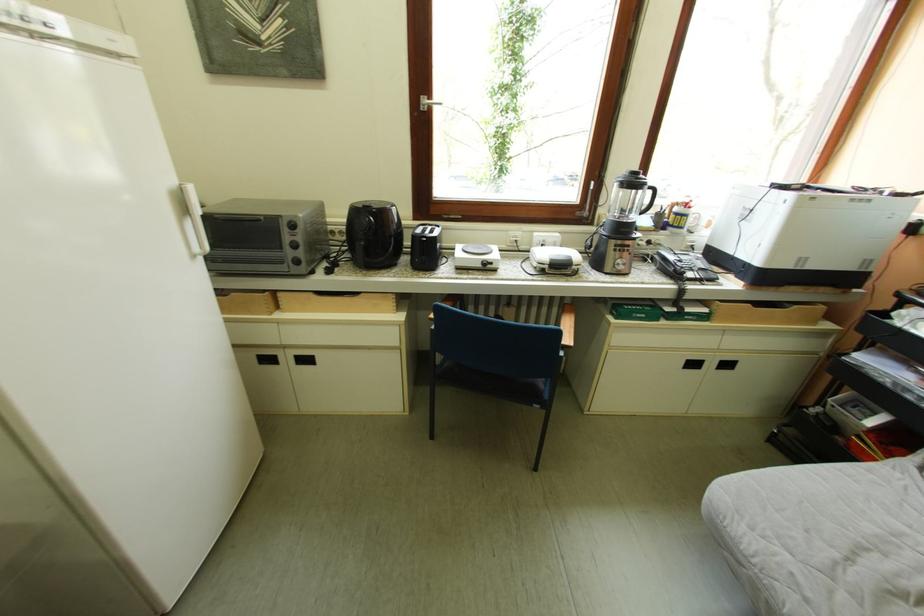
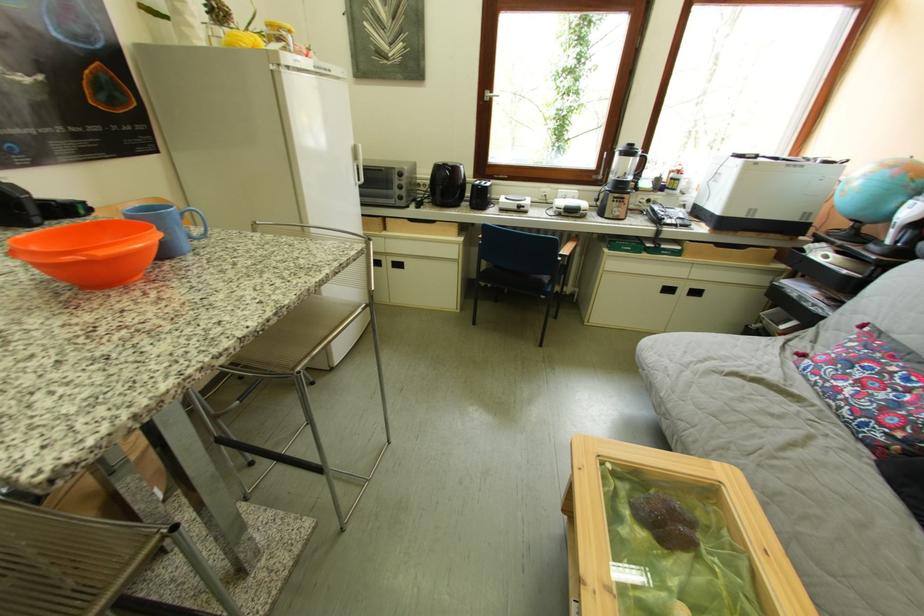
Find the pixel in the second image that matches [634,270] in the first image.

(629, 217)